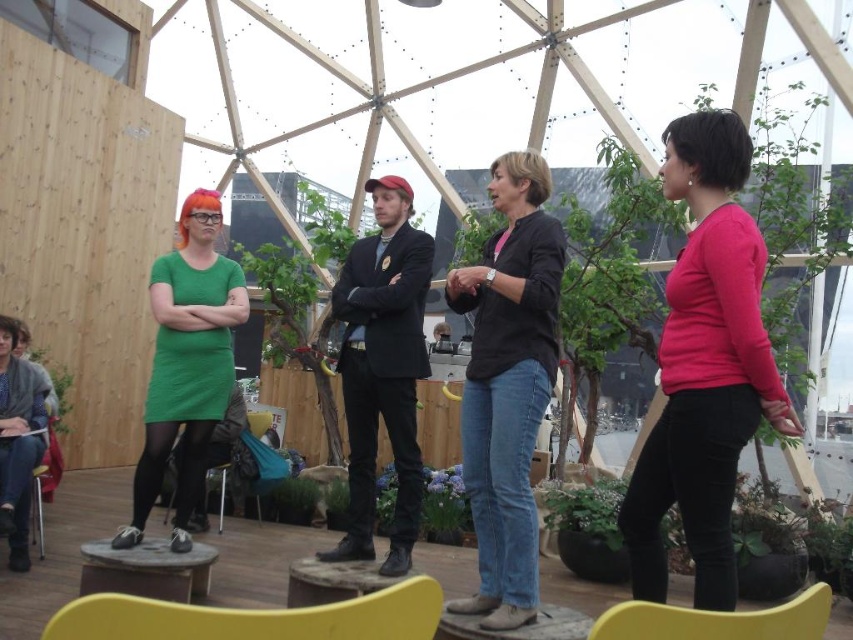
Does matte pink sweater at right have a smaller size compared to matte yellow chair at lower center?

Incorrect, matte pink sweater at right is not smaller in size than matte yellow chair at lower center.

The image size is (853, 640). Find the location of `matte pink sweater at right`. matte pink sweater at right is located at coordinates (704, 365).

The width and height of the screenshot is (853, 640). Identify the location of matte pink sweater at right. (704, 365).

Is denim jeans at center thinner than matte yellow chair at lower center?

No, denim jeans at center is not thinner than matte yellow chair at lower center.

Is denim jeans at center to the right of matte yellow chair at lower center from the viewer's perspective?

In fact, denim jeans at center is to the left of matte yellow chair at lower center.

Does point (480, 353) come in front of point (810, 637)?

No, it is behind (810, 637).

At what (x,y) coordinates should I click in order to perform the action: click on denim jeans at center. Please return your answer as a coordinate pair (x, y). The width and height of the screenshot is (853, 640). Looking at the image, I should click on (508, 385).

Is black suit at center further to camera compared to purple matte plant at center?

No, black suit at center is closer to the viewer.

Who is taller, black suit at center or purple matte plant at center?

black suit at center

Is point (403, 536) farther from camera compared to point (456, 513)?

No.

The height and width of the screenshot is (640, 853). Identify the location of black suit at center. (381, 369).